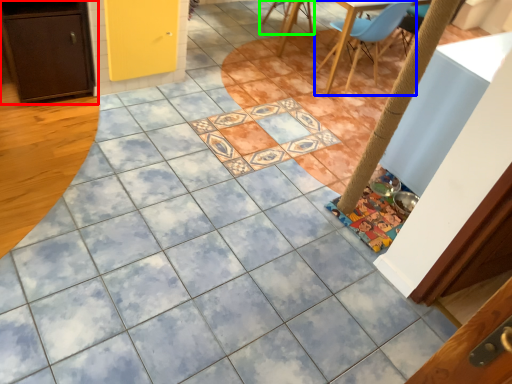
Question: Which is nearer to the cabinetry (highlighted by a red box)? chair (highlighted by a blue box) or chair (highlighted by a green box).

Choices:
 (A) chair
 (B) chair

Answer: (A)